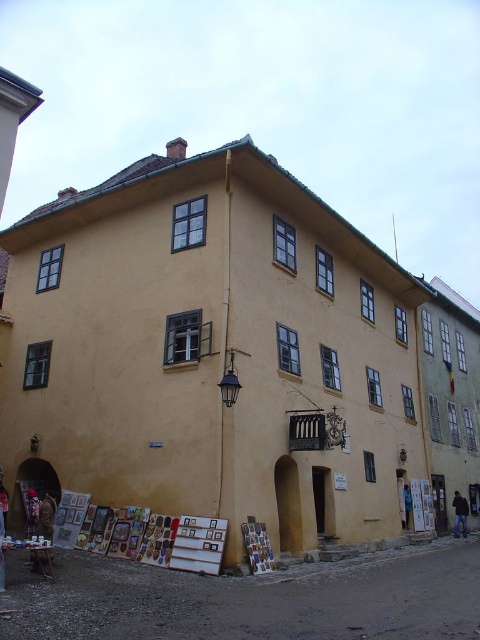
Does dark brown leather jacket at lower right have a larger size compared to wooden framed paintings at lower left?

No.

Who is taller, dark brown leather jacket at lower right or wooden framed paintings at lower left?

Standing taller between the two is dark brown leather jacket at lower right.

What are the coordinates of `dark brown leather jacket at lower right` in the screenshot? It's located at (459, 515).

This screenshot has width=480, height=640. I want to click on dark brown leather jacket at lower right, so click(x=459, y=515).

Does dark brown leather jacket at lower right appear under brown leather jacket at lower right?

Yes.

Which is above, dark brown leather jacket at lower right or brown leather jacket at lower right?

brown leather jacket at lower right is higher up.

Where is `dark brown leather jacket at lower right`? The height and width of the screenshot is (640, 480). dark brown leather jacket at lower right is located at coordinates (459, 515).

Identify the location of dark brown leather jacket at lower right. (459, 515).

Which is in front, point (0, 484) or point (36, 513)?

Point (0, 484) is in front.

Is wooden signboard at lower left taller than wooden framed paintings at lower left?

No, wooden signboard at lower left is not taller than wooden framed paintings at lower left.

Which is behind, point (0, 525) or point (25, 531)?

Positioned behind is point (25, 531).

This screenshot has width=480, height=640. I want to click on wooden signboard at lower left, so click(1, 531).